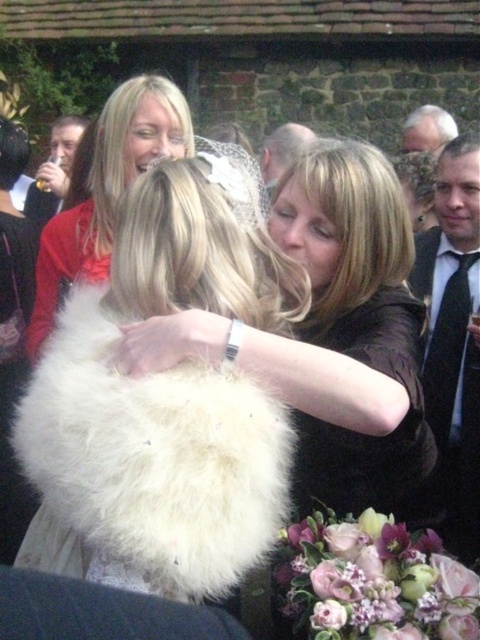
Between point (177, 106) and point (0, 419), which one is positioned behind?

The point (0, 419) is behind.

Is matte white fur at center positioned at the back of white fluffy coat at center?

No, matte white fur at center is closer to the viewer.

Who is more distant from viewer, (151, 160) or (0, 557)?

Point (151, 160)

Locate an element on the screen. This screenshot has width=480, height=640. matte white fur at center is located at coordinates (107, 189).

Who is more distant from viewer, (x=447, y=161) or (x=13, y=128)?

The point (x=13, y=128) is behind.

Is black tie at right thinner than white fluffy coat at center?

Yes, black tie at right is thinner than white fluffy coat at center.

Between point (476, 522) and point (12, 468), which one is positioned in front?

Point (476, 522) is more forward.

The image size is (480, 640). I want to click on black tie at right, so click(452, 348).

Who is more forward, (x=60, y=474) or (x=440, y=124)?

Point (x=60, y=474) is more forward.

Can you confirm if white fluffy fur at center is positioned above white hair at upper right?

No.

This screenshot has width=480, height=640. I want to click on white fluffy fur at center, so click(147, 465).

I want to click on white fluffy fur at center, so [147, 465].